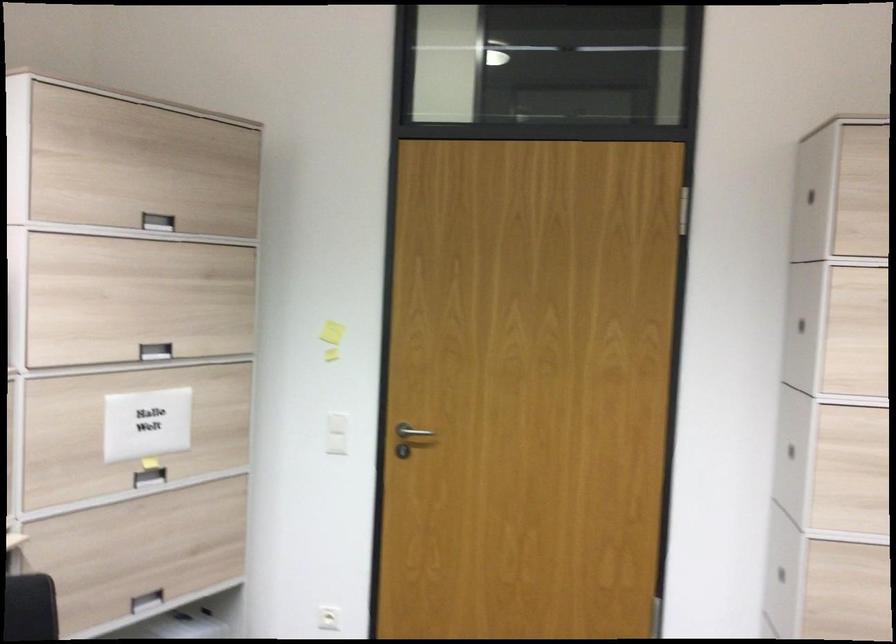
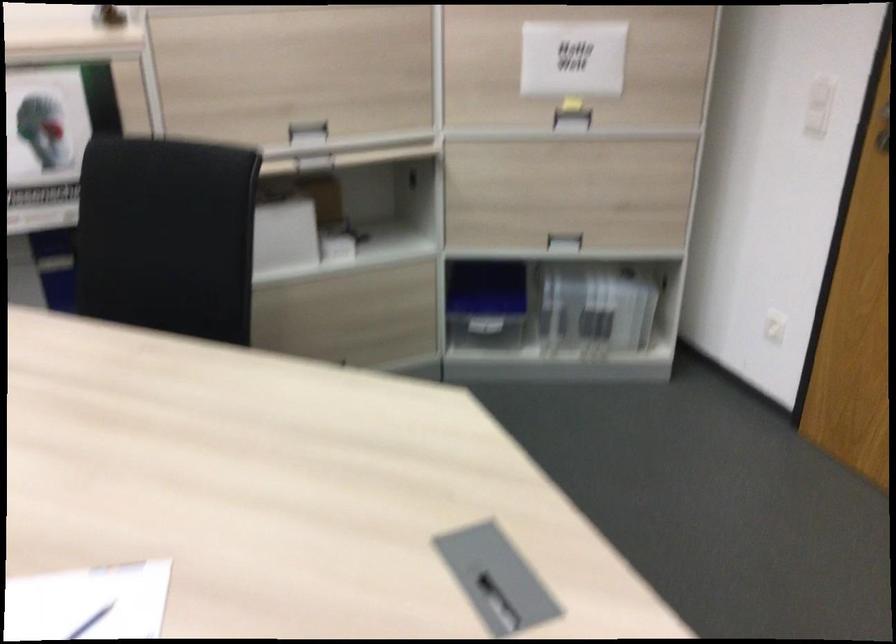
Where in the second image is the point corresponding to (x=152, y=476) from the first image?

(572, 120)